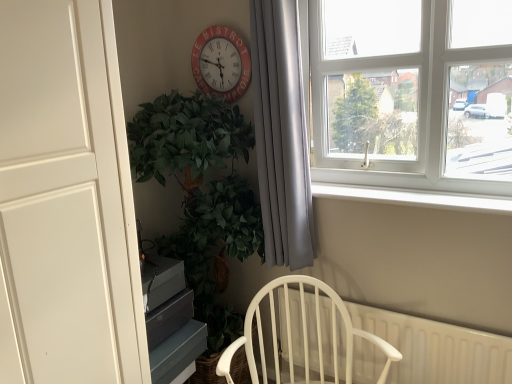
Question: Is white wood chair at lower center at the right side of white plastic radiator at lower right?

Choices:
 (A) yes
 (B) no

Answer: (B)

Question: Is white wood chair at lower center smaller than white plastic radiator at lower right?

Choices:
 (A) no
 (B) yes

Answer: (A)

Question: Can you confirm if white wood chair at lower center is positioned to the left of white plastic radiator at lower right?

Choices:
 (A) yes
 (B) no

Answer: (A)

Question: Is white wood chair at lower center wider than white plastic radiator at lower right?

Choices:
 (A) no
 (B) yes

Answer: (B)

Question: From a real-world perspective, does white wood chair at lower center stand above white plastic radiator at lower right?

Choices:
 (A) no
 (B) yes

Answer: (B)

Question: Considering the positions of matte red clock at upper center and white smooth window sill at upper right in the image, is matte red clock at upper center bigger or smaller than white smooth window sill at upper right?

Choices:
 (A) small
 (B) big

Answer: (A)

Question: From the image's perspective, is matte red clock at upper center above or below white smooth window sill at upper right?

Choices:
 (A) below
 (B) above

Answer: (B)

Question: Relative to white smooth window sill at upper right, is matte red clock at upper center in front or behind?

Choices:
 (A) behind
 (B) front

Answer: (A)

Question: Considering the positions of point (233, 87) and point (428, 196), is point (233, 87) closer or farther from the camera than point (428, 196)?

Choices:
 (A) closer
 (B) farther

Answer: (B)

Question: From a real-world perspective, is matte red clock at upper center positioned above or below green leafy plant at left?

Choices:
 (A) above
 (B) below

Answer: (A)

Question: Based on their positions, is matte red clock at upper center located to the left or right of green leafy plant at left?

Choices:
 (A) right
 (B) left

Answer: (A)

Question: Is point (218, 61) positioned closer to the camera than point (165, 102)?

Choices:
 (A) closer
 (B) farther

Answer: (B)

Question: Considering their positions, is matte red clock at upper center located in front of or behind green leafy plant at left?

Choices:
 (A) behind
 (B) front

Answer: (A)

Question: Considering their positions, is white plastic radiator at lower right located in front of or behind white plastic window at upper right?

Choices:
 (A) front
 (B) behind

Answer: (B)

Question: Is white plastic radiator at lower right spatially inside white plastic window at upper right, or outside of it?

Choices:
 (A) outside
 (B) inside

Answer: (A)